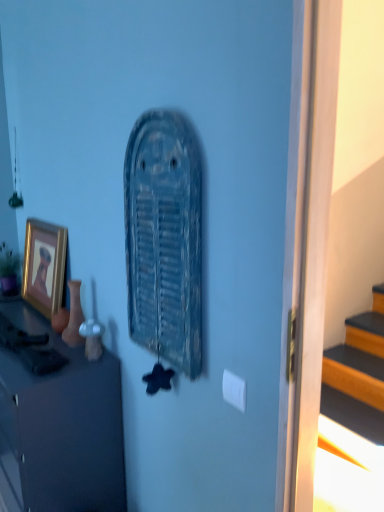
Question: Could you tell me if rusty metal vent at center is facing green matte houseplant at left?

Choices:
 (A) no
 (B) yes

Answer: (A)

Question: Can you confirm if rusty metal vent at center is thinner than green matte houseplant at left?

Choices:
 (A) no
 (B) yes

Answer: (B)

Question: Is rusty metal vent at center looking in the opposite direction of green matte houseplant at left?

Choices:
 (A) yes
 (B) no

Answer: (B)

Question: Does rusty metal vent at center have a greater width compared to green matte houseplant at left?

Choices:
 (A) no
 (B) yes

Answer: (A)

Question: Considering the relative sizes of rusty metal vent at center and green matte houseplant at left in the image provided, is rusty metal vent at center bigger than green matte houseplant at left?

Choices:
 (A) yes
 (B) no

Answer: (A)

Question: From a real-world perspective, is rusty metal vent at center under green matte houseplant at left?

Choices:
 (A) yes
 (B) no

Answer: (B)

Question: Could you tell me if green matte houseplant at left is facing gold-framed picture at left?

Choices:
 (A) yes
 (B) no

Answer: (B)

Question: Is green matte houseplant at left bigger than gold-framed picture at left?

Choices:
 (A) no
 (B) yes

Answer: (A)

Question: Is green matte houseplant at left shorter than gold-framed picture at left?

Choices:
 (A) yes
 (B) no

Answer: (A)

Question: Does green matte houseplant at left have a smaller size compared to gold-framed picture at left?

Choices:
 (A) yes
 (B) no

Answer: (A)

Question: Could gold-framed picture at left be considered to be inside green matte houseplant at left?

Choices:
 (A) yes
 (B) no

Answer: (B)

Question: Is green matte houseplant at left completely or partially outside of gold-framed picture at left?

Choices:
 (A) yes
 (B) no

Answer: (A)

Question: Is gold-framed picture at left oriented away from matte black cabinet at left?

Choices:
 (A) yes
 (B) no

Answer: (B)